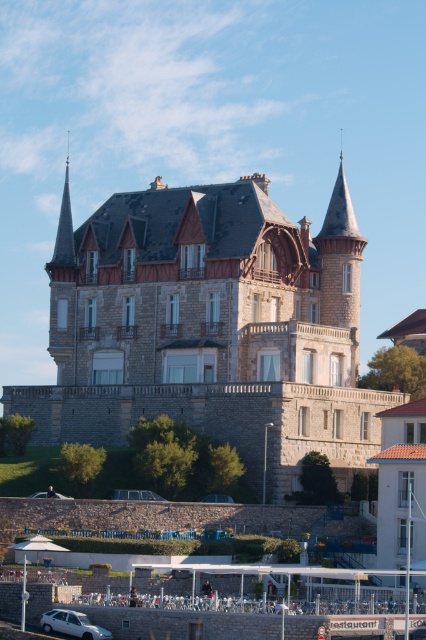
Question: Does stone castle at center have a lesser width compared to white matte car at lower left?

Choices:
 (A) no
 (B) yes

Answer: (A)

Question: Considering the relative positions of stone castle at center and white matte car at lower left in the image provided, where is stone castle at center located with respect to white matte car at lower left?

Choices:
 (A) right
 (B) left

Answer: (A)

Question: In this image, where is stone castle at center located relative to white matte car at lower left?

Choices:
 (A) above
 (B) below

Answer: (A)

Question: Which point is closer to the camera taking this photo?

Choices:
 (A) (192, 246)
 (B) (51, 616)

Answer: (B)